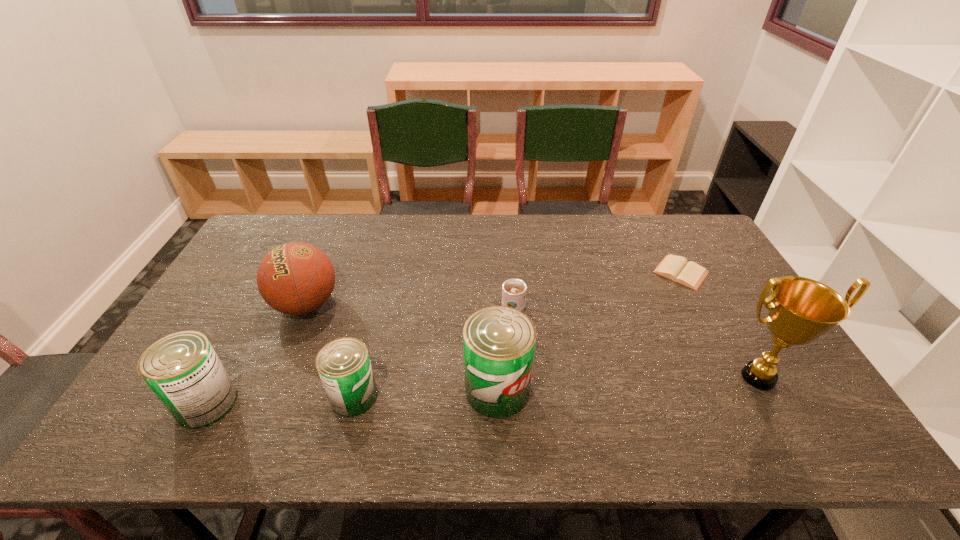
Please point a spot on the right to add another can. Please provide its 2D coordinates. Your answer should be formatted as a tuple, i.e. [(x, y)], where the tuple contains the x and y coordinates of a point satisfying the conditions above.

[(636, 383)]